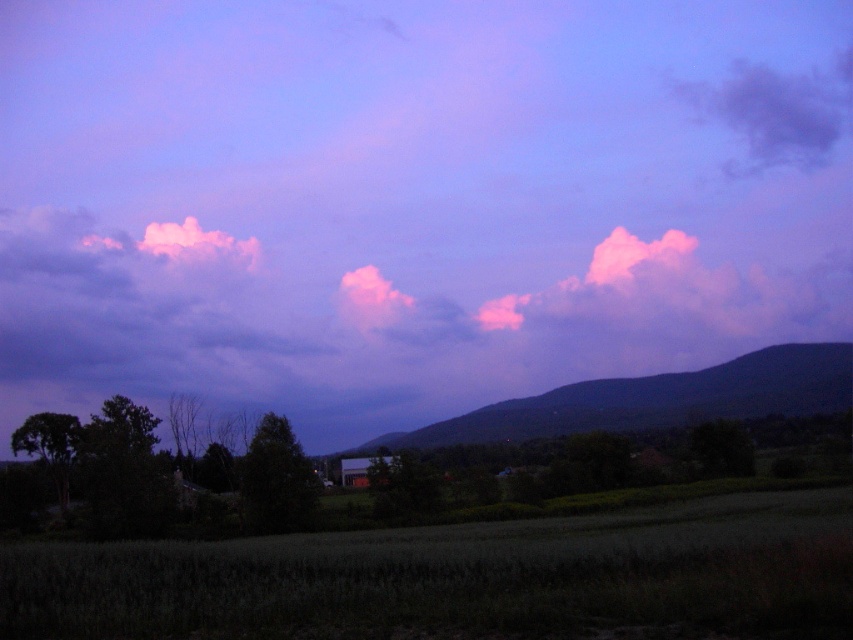
Question: Among these objects, which one is farthest from the camera?

Choices:
 (A) green grassy field at lower center
 (B) purple cotton cloud at upper right
 (C) purple cloud at upper center

Answer: (B)

Question: Does green grassy field at lower center appear on the right side of purple cotton cloud at upper right?

Choices:
 (A) no
 (B) yes

Answer: (A)

Question: Which object is the closest to the green grassy field at lower center?

Choices:
 (A) dark purple mountain at center
 (B) purple cloud at upper center

Answer: (A)

Question: Can you confirm if dark purple mountain at center is bigger than purple cotton cloud at upper right?

Choices:
 (A) yes
 (B) no

Answer: (A)

Question: Is dark purple mountain at center bigger than purple cotton cloud at upper right?

Choices:
 (A) yes
 (B) no

Answer: (A)

Question: Which point is closer to the camera?

Choices:
 (A) (467, 620)
 (B) (751, 64)
 (C) (421, 433)
 (D) (163, 74)

Answer: (A)